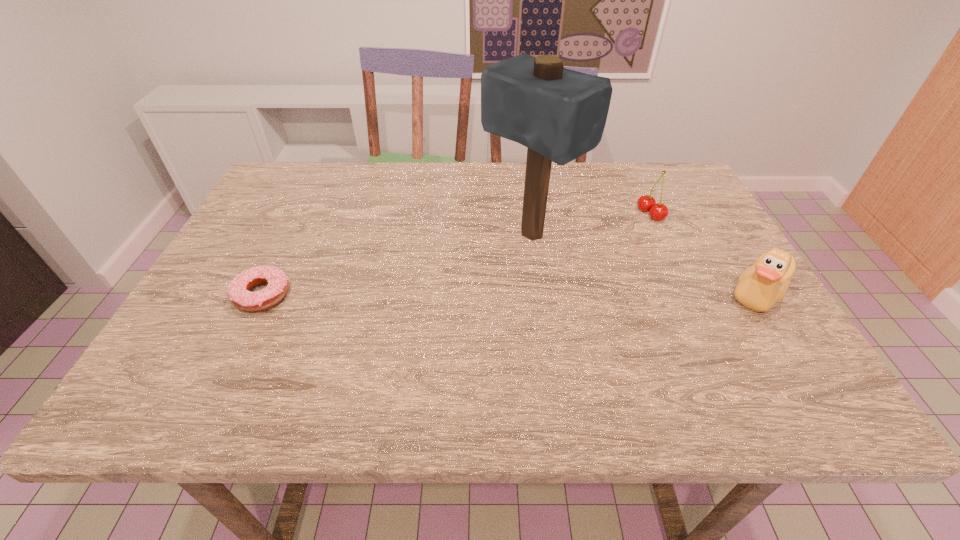
You are a GUI agent. You are given a task and a screenshot of the screen. Output one action in this format:
    pyautogui.click(x=<x>, y=<y>)
    Task: Click on the free space between the rightmost object and the third object from left to right
    
    Given the screenshot: What is the action you would take?
    pyautogui.click(x=704, y=253)

Where is `empty space that is in between the second object from left to right and the duck`? empty space that is in between the second object from left to right and the duck is located at coordinates (644, 264).

Find the location of a particular element. The height and width of the screenshot is (540, 960). free space that is in between the rightmost object and the second object from right to left is located at coordinates (704, 253).

Find the location of a particular element. free space between the duck and the cherry is located at coordinates (704, 253).

Identify the location of empty space that is in between the cherry and the shortest object. This screenshot has width=960, height=540. (456, 255).

Where is `vacant space that's between the doughnut and the tallest object`? The height and width of the screenshot is (540, 960). vacant space that's between the doughnut and the tallest object is located at coordinates (396, 265).

Locate an element on the screen. This screenshot has width=960, height=540. free spot between the doughnut and the mallet is located at coordinates (396, 265).

Locate an element on the screen. The width and height of the screenshot is (960, 540). free area in between the rightmost object and the doughnut is located at coordinates (510, 294).

The width and height of the screenshot is (960, 540). What are the coordinates of `free point between the leftmost object and the second object from right to left` in the screenshot? It's located at (456, 255).

Identify which object is the third closest to the third object from right to left. Please provide its 2D coordinates. Your answer should be formatted as a tuple, i.e. [(x, y)], where the tuple contains the x and y coordinates of a point satisfying the conditions above.

[(239, 292)]